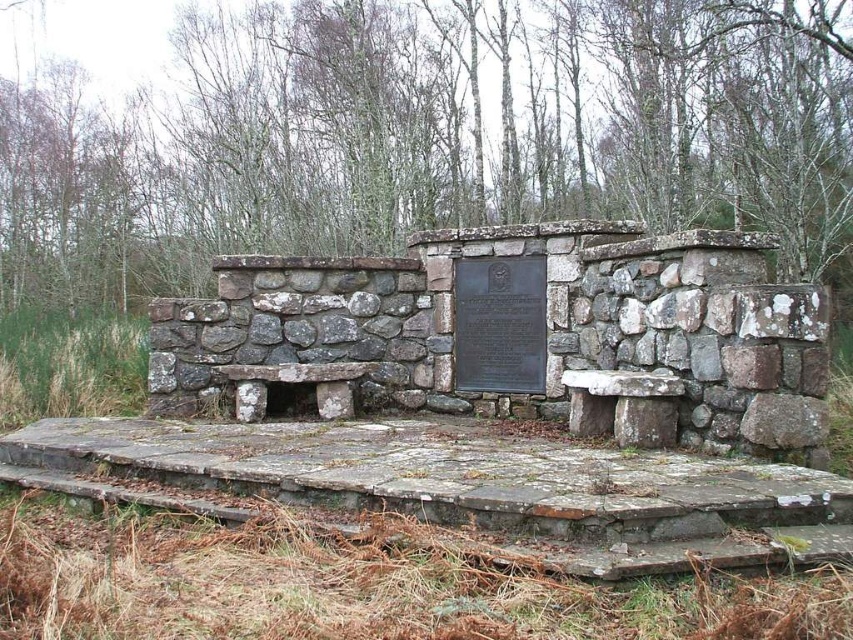
Who is positioned more to the right, rustic stone bench at center or bronze plaque at center?

Positioned to the right is bronze plaque at center.

Is rustic stone bench at center to the right of bronze plaque at center from the viewer's perspective?

Incorrect, rustic stone bench at center is not on the right side of bronze plaque at center.

Is point (659, 429) positioned before point (543, 314)?

Yes, it is.

This screenshot has height=640, width=853. What are the coordinates of `rustic stone bench at center` in the screenshot? It's located at (520, 336).